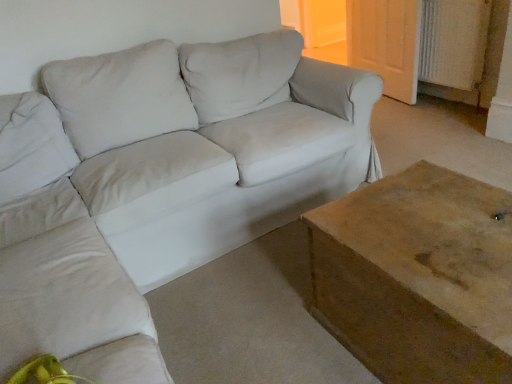
Question: Is white textured radiator at upper right looking in the opposite direction of light beige fabric couch at center?

Choices:
 (A) no
 (B) yes

Answer: (A)

Question: Does white textured radiator at upper right have a smaller size compared to light beige fabric couch at center?

Choices:
 (A) no
 (B) yes

Answer: (B)

Question: From the image's perspective, is white textured radiator at upper right under light beige fabric couch at center?

Choices:
 (A) no
 (B) yes

Answer: (A)

Question: Can you confirm if white textured radiator at upper right is wider than light beige fabric couch at center?

Choices:
 (A) no
 (B) yes

Answer: (A)

Question: Considering the relative positions of white textured radiator at upper right and light beige fabric couch at center in the image provided, is white textured radiator at upper right to the left of light beige fabric couch at center from the viewer's perspective?

Choices:
 (A) no
 (B) yes

Answer: (A)

Question: Based on their sizes in the image, would you say wooden door at upper right is bigger or smaller than white textured radiator at upper right?

Choices:
 (A) big
 (B) small

Answer: (A)

Question: In the image, is wooden door at upper right positioned in front of or behind white textured radiator at upper right?

Choices:
 (A) front
 (B) behind

Answer: (B)

Question: Considering the positions of point (381, 52) and point (418, 49), is point (381, 52) closer or farther from the camera than point (418, 49)?

Choices:
 (A) farther
 (B) closer

Answer: (A)

Question: From a real-world perspective, is wooden door at upper right above or below white textured radiator at upper right?

Choices:
 (A) below
 (B) above

Answer: (A)

Question: Based on their positions, is white textured radiator at upper right located to the left or right of light beige fabric couch at center?

Choices:
 (A) left
 (B) right

Answer: (B)

Question: Based on their sizes in the image, would you say white textured radiator at upper right is bigger or smaller than light beige fabric couch at center?

Choices:
 (A) small
 (B) big

Answer: (A)

Question: Is white textured radiator at upper right in front of or behind light beige fabric couch at center in the image?

Choices:
 (A) front
 (B) behind

Answer: (B)

Question: Considering the positions of white textured radiator at upper right and light beige fabric couch at center in the image, is white textured radiator at upper right taller or shorter than light beige fabric couch at center?

Choices:
 (A) short
 (B) tall

Answer: (A)

Question: Would you say wooden table at lower right is to the left or to the right of white textured radiator at upper right in the picture?

Choices:
 (A) right
 (B) left

Answer: (B)

Question: Is point (483, 233) closer or farther from the camera than point (429, 28)?

Choices:
 (A) closer
 (B) farther

Answer: (A)